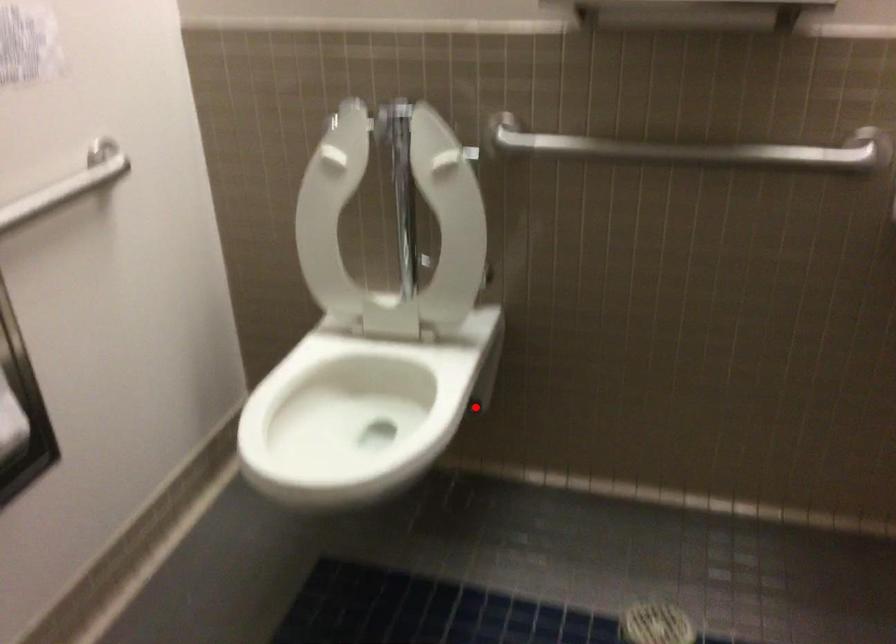
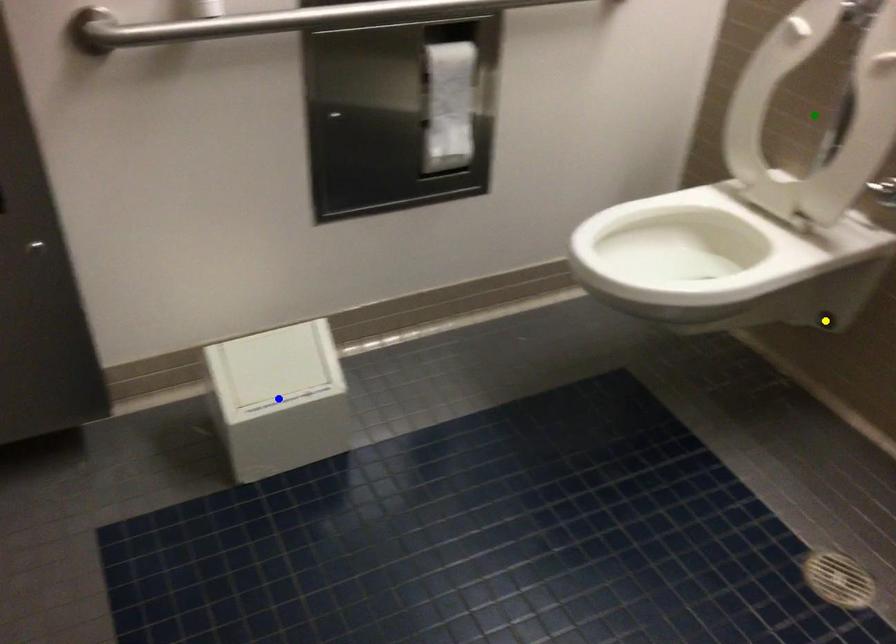
Question: I am providing you with two images of the same scene from different viewpoints. A red point is marked on the first image. You are given multiple points on the second image. In image 2, which mark is for the same physical point as the one in image 1?

Choices:
 (A) yellow point
 (B) blue point
 (C) green point

Answer: (A)